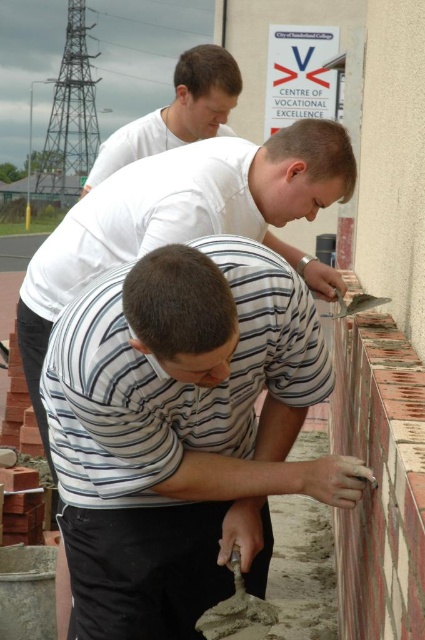
Question: Does white matte shirt at center have a smaller size compared to rustic clay bricks at right?

Choices:
 (A) yes
 (B) no

Answer: (B)

Question: Does white striped shirt at center come in front of white matte shirt at upper center?

Choices:
 (A) no
 (B) yes

Answer: (B)

Question: Which object is closer to the camera taking this photo?

Choices:
 (A) white striped shirt at center
 (B) white matte shirt at center
 (C) white matte shirt at upper center

Answer: (A)

Question: Which point appears closest to the camera in this image?

Choices:
 (A) (198, 122)
 (B) (365, 326)
 (C) (277, 218)
 (D) (90, 456)

Answer: (D)

Question: Does rustic clay bricks at right appear over white matte shirt at upper center?

Choices:
 (A) no
 (B) yes

Answer: (A)

Question: Which point appears farthest from the camera in this image?

Choices:
 (A) (391, 483)
 (B) (193, 529)
 (C) (294, 125)
 (D) (163, 150)

Answer: (D)